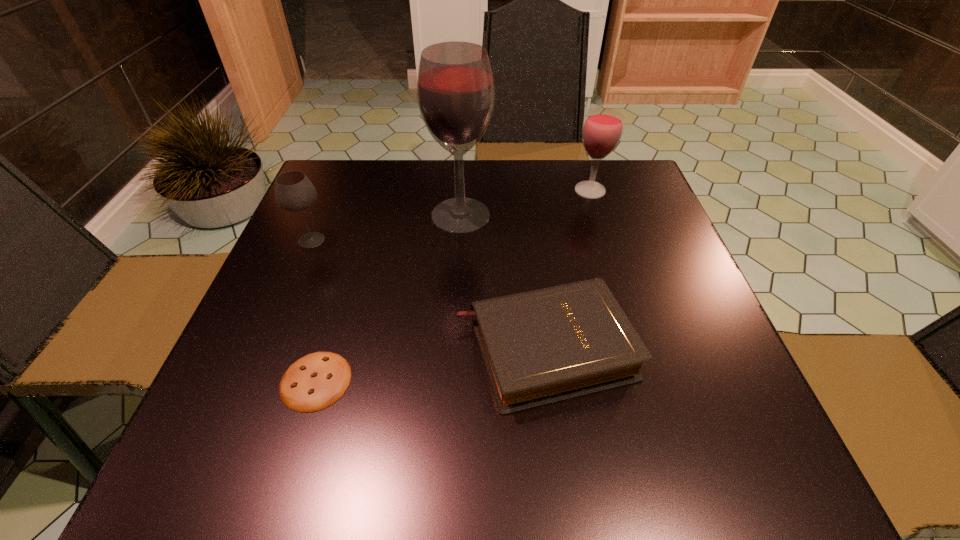
At what (x,y) coordinates should I click in order to perform the action: click on the tallest object. Please return your answer as a coordinate pair (x, y). The image size is (960, 540). Looking at the image, I should click on (455, 89).

This screenshot has width=960, height=540. In order to click on the second tallest object in this screenshot , I will do `click(602, 128)`.

Identify the location of the farther wineglass. (602, 128).

In order to click on the shorter wineglass in this screenshot , I will do `click(294, 192)`.

Identify the location of the left wineglass. This screenshot has width=960, height=540. (294, 192).

Image resolution: width=960 pixels, height=540 pixels. Find the location of `Bible`. Bible is located at coordinates 542,346.

This screenshot has height=540, width=960. Find the location of `the second object from left to right`. the second object from left to right is located at coordinates (317, 380).

At what (x,y) coordinates should I click in order to perform the action: click on cookie. Please return your answer as a coordinate pair (x, y). The width and height of the screenshot is (960, 540). Looking at the image, I should click on (317, 380).

The width and height of the screenshot is (960, 540). What are the coordinates of `vacant area situated on the front of the alcohol` in the screenshot? It's located at (456, 307).

You are a GUI agent. You are given a task and a screenshot of the screen. Output one action in this format:
    pyautogui.click(x=<x>, y=<y>)
    Task: Click on the free space located on the left of the fourth shortest object
    
    Given the screenshot: What is the action you would take?
    [x=438, y=190]